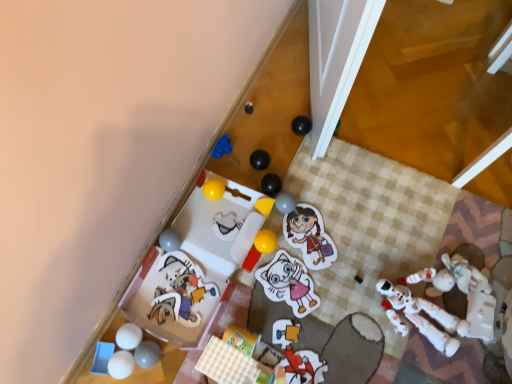
At what (x,y) coordinates should I click in order to perform the action: click on vacant position to the left of rubber matte ball at center, which ranks as the thirteenth toy in left-to-right order. Please return your answer as a coordinate pair (x, y). The image size is (512, 384). Looking at the image, I should click on (234, 212).